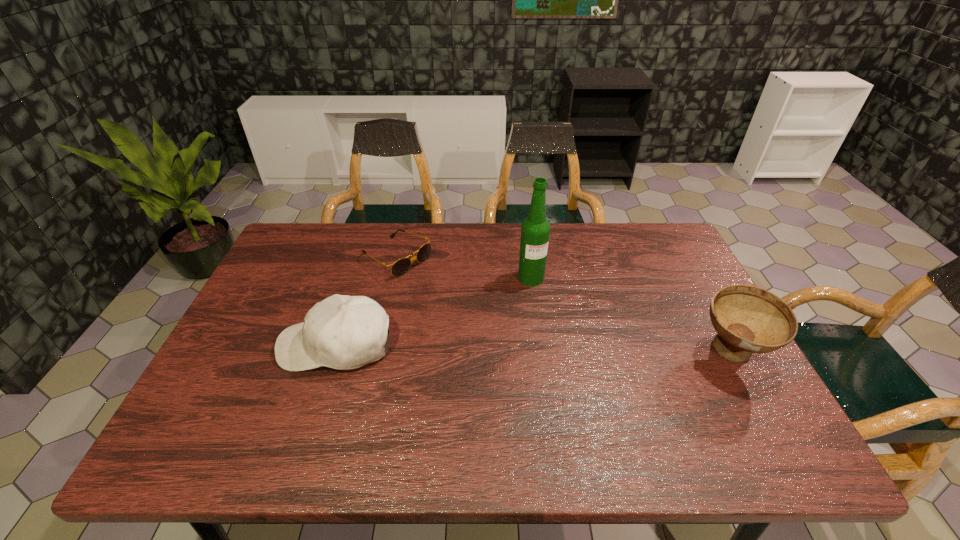
Where is `free space on the desktop that is between the baseball cap and the soup bowl and is positioned on the label of the tallest object`? Image resolution: width=960 pixels, height=540 pixels. free space on the desktop that is between the baseball cap and the soup bowl and is positioned on the label of the tallest object is located at coordinates (574, 350).

Find the location of `vacant space on the desktop that is between the baseball cap and the rightmost object and is positioned on the lenses of the shortest object`. vacant space on the desktop that is between the baseball cap and the rightmost object and is positioned on the lenses of the shortest object is located at coordinates (540, 349).